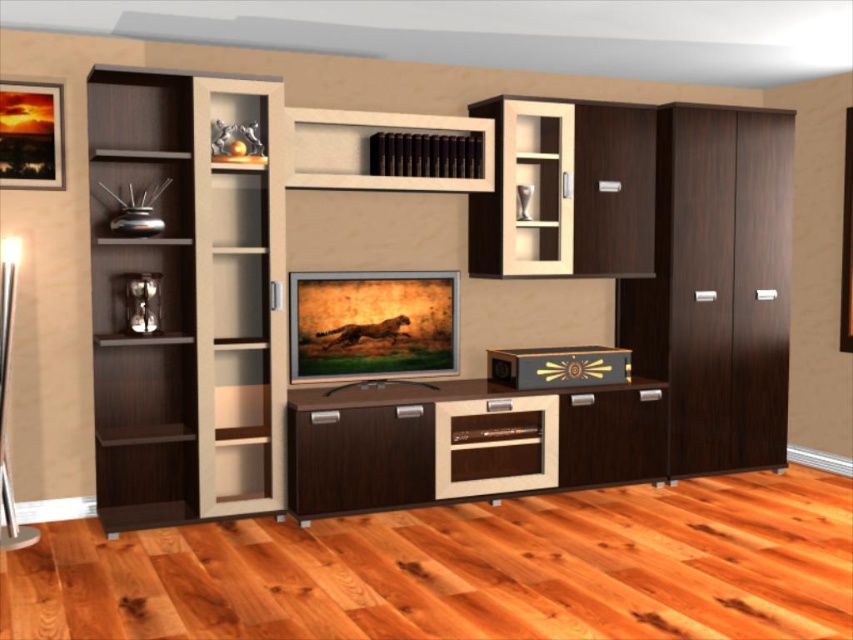
Who is positioned more to the right, dark wood/woodenbookshelf at left or brown matte books at upper center?

Positioned to the right is brown matte books at upper center.

Can you confirm if dark wood/woodenbookshelf at left is positioned above brown matte books at upper center?

Incorrect, dark wood/woodenbookshelf at left is not positioned above brown matte books at upper center.

Between point (223, 221) and point (463, 182), which one is positioned in front?

Positioned in front is point (223, 221).

Where is `dark wood/woodenbookshelf at left`? This screenshot has height=640, width=853. dark wood/woodenbookshelf at left is located at coordinates (189, 300).

Who is shorter, dark wood entertainment center at center or dark wood/woodenbookshelf at left?

Standing shorter between the two is dark wood/woodenbookshelf at left.

You are a GUI agent. You are given a task and a screenshot of the screen. Output one action in this format:
    pyautogui.click(x=<x>, y=<y>)
    Task: Click on the dark wood entertainment center at center
    
    Given the screenshot: What is the action you would take?
    pyautogui.click(x=480, y=276)

At what (x,y) coordinates should I click in order to perform the action: click on dark wood entertainment center at center. Please return your answer as a coordinate pair (x, y). The image size is (853, 640). Looking at the image, I should click on (480, 276).

Is point (660, 355) positioned after point (538, 188)?

That is True.

Between dark wood entertainment center at center and matte wood shelf at upper center, which one has more height?

Standing taller between the two is dark wood entertainment center at center.

Is point (705, 284) behind point (498, 268)?

Yes, point (705, 284) is farther from viewer.

Find the location of a particular element. Image resolution: width=853 pixels, height=640 pixels. dark wood entertainment center at center is located at coordinates (480, 276).